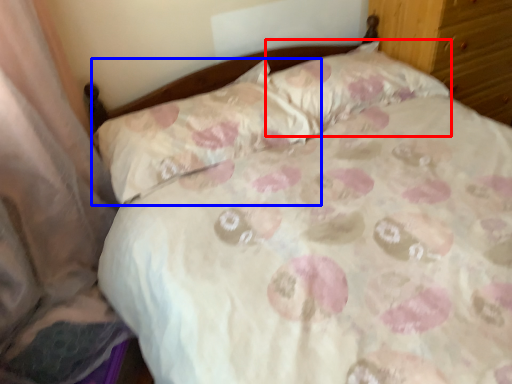
Question: Which object appears farthest to the camera in this image, pillow (highlighted by a red box) or pillow (highlighted by a blue box)?

Choices:
 (A) pillow
 (B) pillow

Answer: (A)